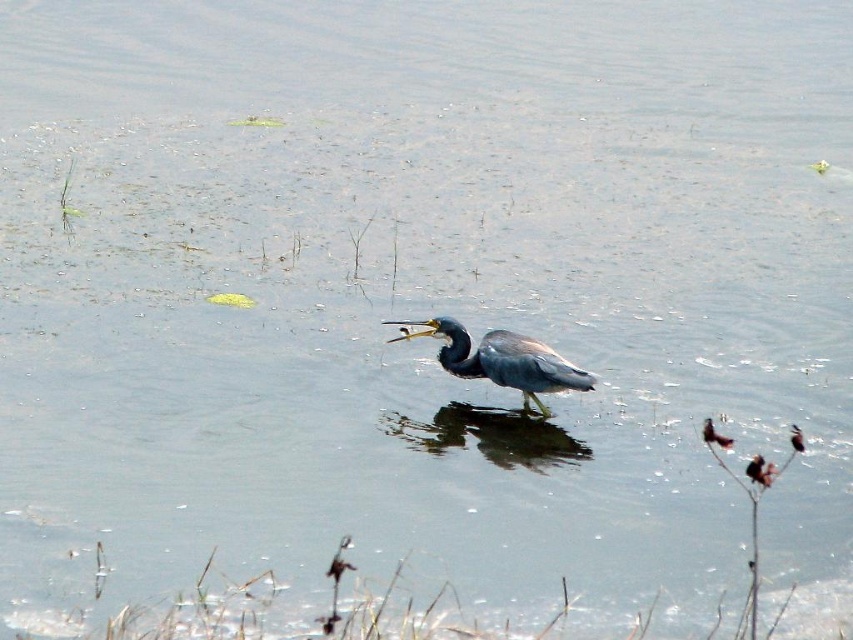
You are an ornithologist observing two birds in a wetland. You notice a shiny black bird at center and a gray matte bird at center. Which bird has a smaller width?

The shiny black bird at center has a smaller width than the gray matte bird at center.

You are a wildlife photographer trying to capture a photo of the shiny brown bird at center and the gray matte bird at center. Which bird should you focus on if you want to photograph the taller one?

The gray matte bird at center is taller than the shiny brown bird at center, so you should focus on the gray matte bird at center to capture the taller one.

You are a nature photographer observing the scene. You need to capture a clear photo of the shiny brown bird at center and the gray matte bird at center. Which bird will appear larger in the photo?

The shiny brown bird at center will appear larger in the photo because it is positioned in front of the gray matte bird at center, making it closer to the camera.